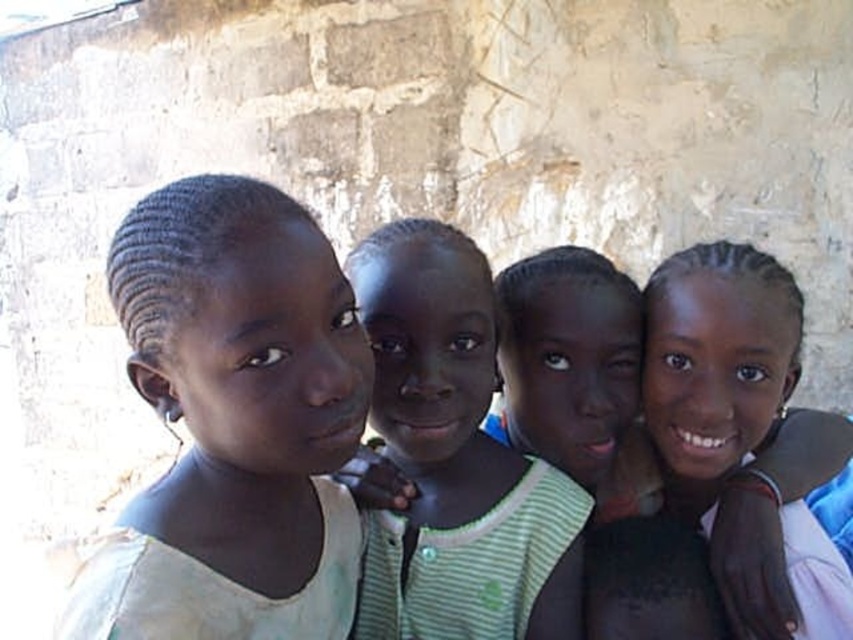
Who is lower down, light beige fabric at center or green striped shirt at center?

green striped shirt at center

Is light beige fabric at center thinner than green striped shirt at center?

Yes.

The height and width of the screenshot is (640, 853). I want to click on light beige fabric at center, so click(x=233, y=422).

Between green striped shirt at center and smooth skin girl at right, which one has less height?

With less height is smooth skin girl at right.

Is point (376, 237) farther from camera compared to point (651, 436)?

No, (376, 237) is closer to viewer.

The image size is (853, 640). What are the coordinates of `green striped shirt at center` in the screenshot? It's located at (451, 460).

Looking at this image, can you confirm if light beige fabric at center is positioned above smooth skin girl at right?

Yes, light beige fabric at center is above smooth skin girl at right.

This screenshot has width=853, height=640. I want to click on light beige fabric at center, so click(233, 422).